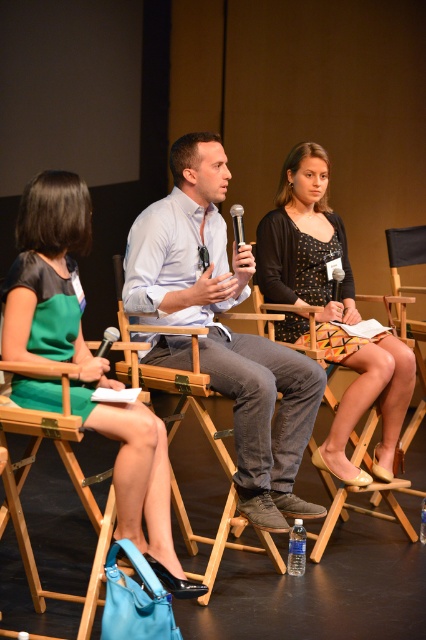
Where is the green satin dress at center located in the image?

The green satin dress at center is located at point 0.567 on the x axis and 0.207 on the y axis.

You are an event planner setting up the stage for the panel discussion. You need to ensure that the green satin dress at center and the metallic silver microphone at center are visible to the audience. Which object should be placed closer to the front of the stage to ensure visibility?

The green satin dress at center is larger in size than the metallic silver microphone at center, so placing the larger green satin dress at center closer to the front of the stage will ensure both objects are visible to the audience.

Looking at this image, where is the green satin dress at center located in the image?

The green satin dress at center is located at point 0.567 on the x axis and 0.207 on the y axis.